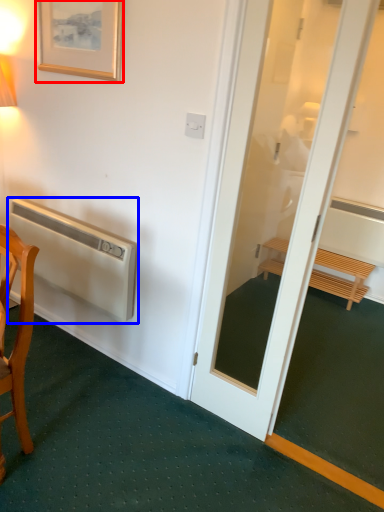
Question: Which object is further to the camera taking this photo, picture frame (highlighted by a red box) or air conditioner (highlighted by a blue box)?

Choices:
 (A) picture frame
 (B) air conditioner

Answer: (B)